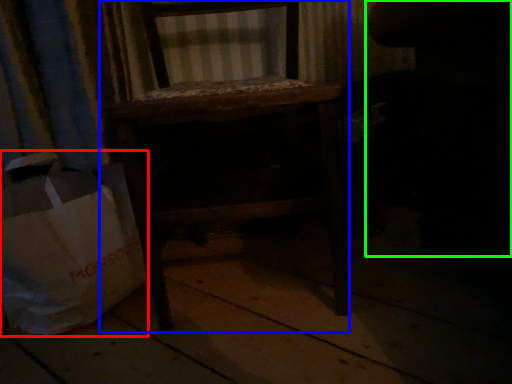
Question: Which is farther away from grocery bag (highlighted by a red box)? furniture (highlighted by a blue box) or swivel chair (highlighted by a green box)?

Choices:
 (A) furniture
 (B) swivel chair

Answer: (B)